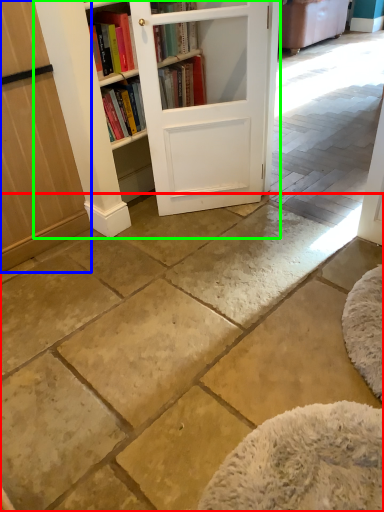
Question: Which object is the closest to the concrete (highlighted by a red box)? Choose among these: screen door (highlighted by a blue box) or bookcase (highlighted by a green box).

Choices:
 (A) screen door
 (B) bookcase

Answer: (A)